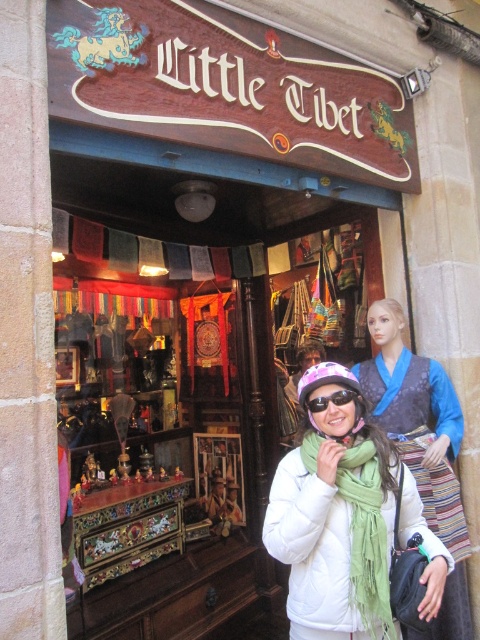
You are a shop assistant at Little Tibet. A customer asks if the green fringed scarf at center can be worn over the white matte jacket at center. Based on their sizes, can you confirm if the scarf is large enough to cover the jacket?

The white matte jacket at center is larger in size than the green fringed scarf at center. Therefore, the green fringed scarf at center may not be large enough to fully cover the white matte jacket at center.

You are a customer standing outside the shop entrance. You see the white matte jacket at center and the matte purple goggles at center. Which object is positioned to the right side from your perspective?

The white matte jacket at center is positioned to the right of the matte purple goggles at center.